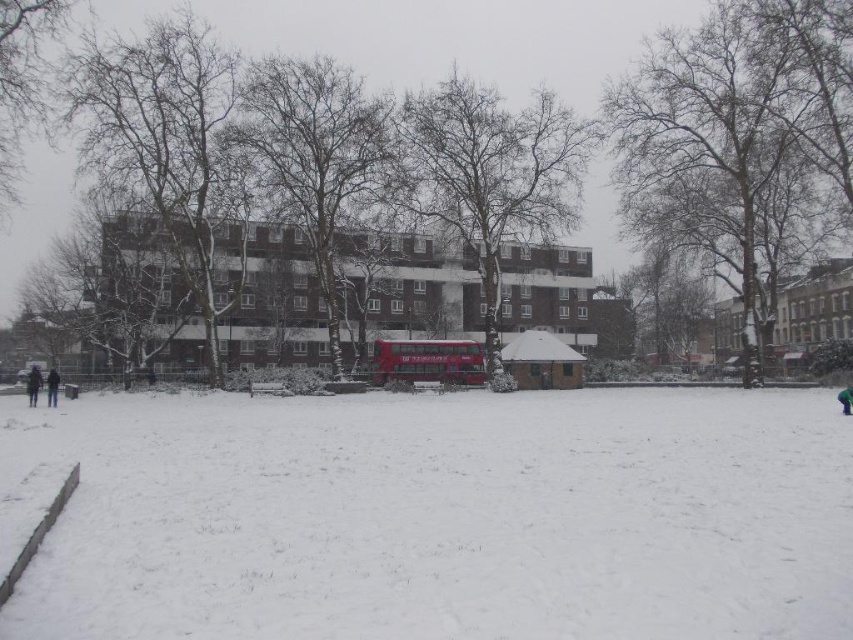
Question: Which object is the closest to the red metallic double-decker bus at center?

Choices:
 (A) dark blue jacket at lower left
 (B) brown wooden bus stop at center

Answer: (B)

Question: Is dark blue jacket at lower left to the left of dark blue jeans at lower left from the viewer's perspective?

Choices:
 (A) no
 (B) yes

Answer: (B)

Question: Among these objects, which one is nearest to the camera?

Choices:
 (A) red metallic double-decker bus at center
 (B) brown wooden bus stop at center
 (C) white fluffy snow at center

Answer: (C)

Question: Does red metallic double-decker bus at center appear on the right side of dark blue jacket at lower left?

Choices:
 (A) no
 (B) yes

Answer: (B)

Question: Does white fluffy snow at center have a smaller size compared to dark blue jeans at lower left?

Choices:
 (A) no
 (B) yes

Answer: (B)

Question: Which object is farther from the camera taking this photo?

Choices:
 (A) dark blue jacket at lower left
 (B) dark blue jeans at lower left

Answer: (A)